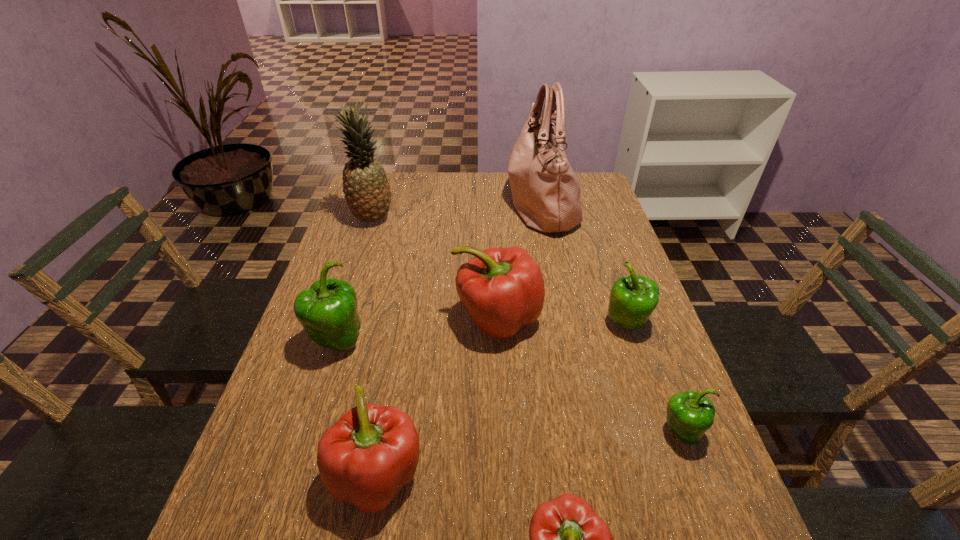
In the image, there is a desktop. Where is `vacant space at the far edge`? The width and height of the screenshot is (960, 540). vacant space at the far edge is located at coordinates (472, 205).

Image resolution: width=960 pixels, height=540 pixels. In order to click on free space at the left edge in this screenshot , I will do `click(352, 257)`.

In the image, there is a desktop. In order to click on free space at the right edge in this screenshot , I will do click(x=710, y=465).

Where is `vacant point located between the pineapple and the leftmost green bell pepper`? vacant point located between the pineapple and the leftmost green bell pepper is located at coordinates (354, 280).

Where is `free area in between the pineapple and the biggest pink bell pepper`? free area in between the pineapple and the biggest pink bell pepper is located at coordinates (435, 268).

The image size is (960, 540). What are the coordinates of `empty space between the second biggest green bell pepper and the nearest green bell pepper` in the screenshot? It's located at (654, 379).

The height and width of the screenshot is (540, 960). I want to click on vacant area that lies between the second biggest green bell pepper and the farthest pink bell pepper, so click(x=562, y=321).

Locate an element on the screen. free space between the pineapple and the leftmost green bell pepper is located at coordinates (354, 280).

Where is `vacant region between the handbag and the pineapple`? The width and height of the screenshot is (960, 540). vacant region between the handbag and the pineapple is located at coordinates coord(457,211).

I want to click on free space between the biggest pink bell pepper and the second biggest green bell pepper, so click(562, 321).